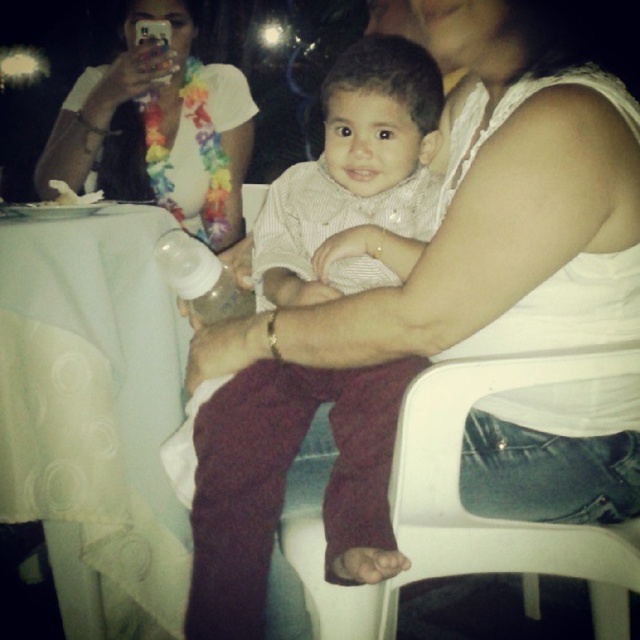
Question: Among these objects, which one is nearest to the camera?

Choices:
 (A) transparent plastic bottle at center
 (B) white plastic chair at lower right
 (C) white fabric lei at upper left
 (D) white fabric table at left

Answer: (B)

Question: Does striped cotton shirt at center appear on the left side of transparent plastic bottle at center?

Choices:
 (A) no
 (B) yes

Answer: (A)

Question: Can you confirm if white fabric lei at upper left is wider than transparent plastic bottle at center?

Choices:
 (A) yes
 (B) no

Answer: (A)

Question: Does white fabric table at left appear on the left side of striped cotton shirt at center?

Choices:
 (A) yes
 (B) no

Answer: (A)

Question: Among these objects, which one is nearest to the camera?

Choices:
 (A) white plastic chair at lower right
 (B) white fabric lei at upper left
 (C) transparent plastic bottle at center

Answer: (A)

Question: Which point is closer to the camera?

Choices:
 (A) white fabric lei at upper left
 (B) transparent plastic bottle at center
 (C) white fabric table at left

Answer: (C)